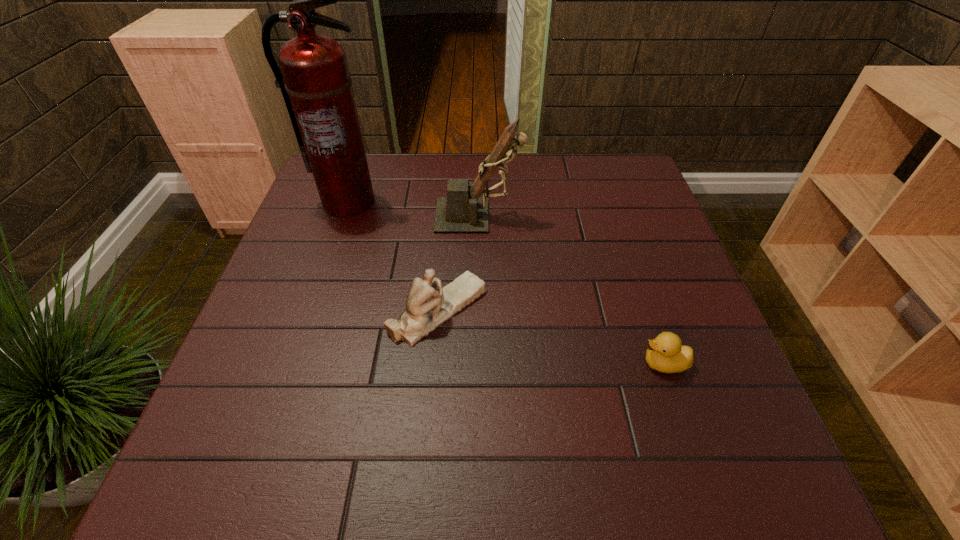
You are a GUI agent. You are given a task and a screenshot of the screen. Output one action in this format:
    pyautogui.click(x=<x>, y=<y>)
    Task: Click on the free space located on the front-facing side of the third tallest object
    This screenshot has width=960, height=540.
    Given the screenshot: What is the action you would take?
    pyautogui.click(x=633, y=309)

Image resolution: width=960 pixels, height=540 pixels. I want to click on free location located 0.070m on the face of the nearest object, so click(604, 363).

You are a GUI agent. You are given a task and a screenshot of the screen. Output one action in this format:
    pyautogui.click(x=<x>, y=<y>)
    Task: Click on the free region located 0.140m on the face of the nearest object
    The width and height of the screenshot is (960, 540).
    Given the screenshot: What is the action you would take?
    pyautogui.click(x=568, y=363)

Where is `blank area located on the face of the nearest object`? blank area located on the face of the nearest object is located at coordinates (488, 363).

Where is `object at the far edge`? object at the far edge is located at coordinates (315, 82).

Where is `object present at the left edge`? The width and height of the screenshot is (960, 540). object present at the left edge is located at coordinates (315, 82).

This screenshot has height=540, width=960. In order to click on object located in the right edge section of the desktop in this screenshot , I will do `click(665, 353)`.

This screenshot has width=960, height=540. Identify the location of object that is at the far left corner. (315, 82).

At what (x,y) coordinates should I click in order to perform the action: click on free space at the far edge of the desktop. Please return your answer as a coordinate pair (x, y). Looking at the image, I should click on (468, 159).

In the image, there is a desktop. At what (x,y) coordinates should I click in order to perform the action: click on vacant space at the near edge. Please return your answer as a coordinate pair (x, y). Looking at the image, I should click on (605, 467).